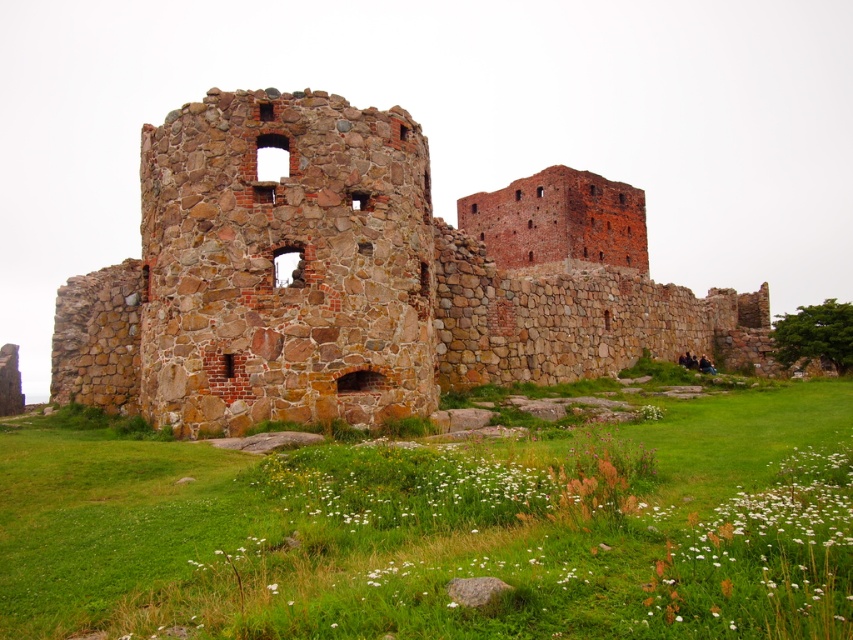
You are a gardener planning to plant flowers in the green grassy area at center. The brown stone castle at center is in the way. Can you plant flowers in the green grassy at center without disturbing the castle?

The green grassy at center is thinner than brown stone castle at center, so the castle is wider. Therefore, you can plant flowers in the green grassy area at center as long as you avoid the area occupied by the castle.

You are standing at the edge of a grassy field and see the green grassy at center and the brown stone castle at center. Which object is closer to you?

The green grassy at center is closer to you since it is only 35.17 meters away from the brown stone castle at center, which is further away.

You are a medieval architect examining the ruins. You need to determine which area is more suitable for setting up a temporary campsite. Based on the scene, which area has more space? Please choose between the green grassy at center and the brown stone castle at center.

The brown stone castle at center is larger in size compared to the green grassy at center, so the brown stone castle at center has more space for setting up a temporary campsite.